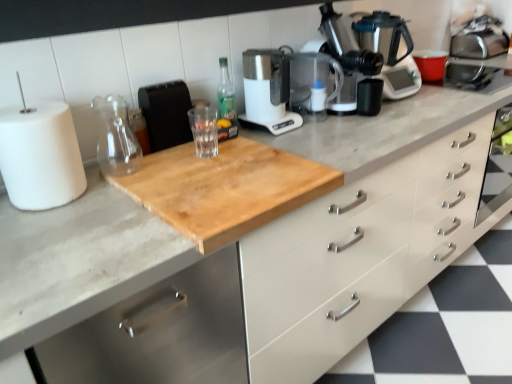
I want to click on free space in front of black matte cup at center, which is the first appliance in right-to-left order, so click(x=384, y=125).